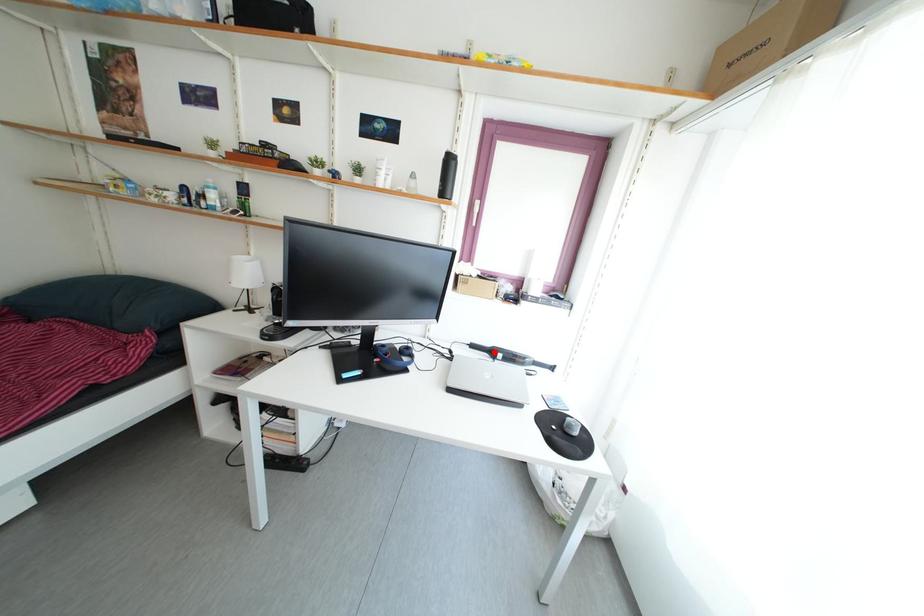
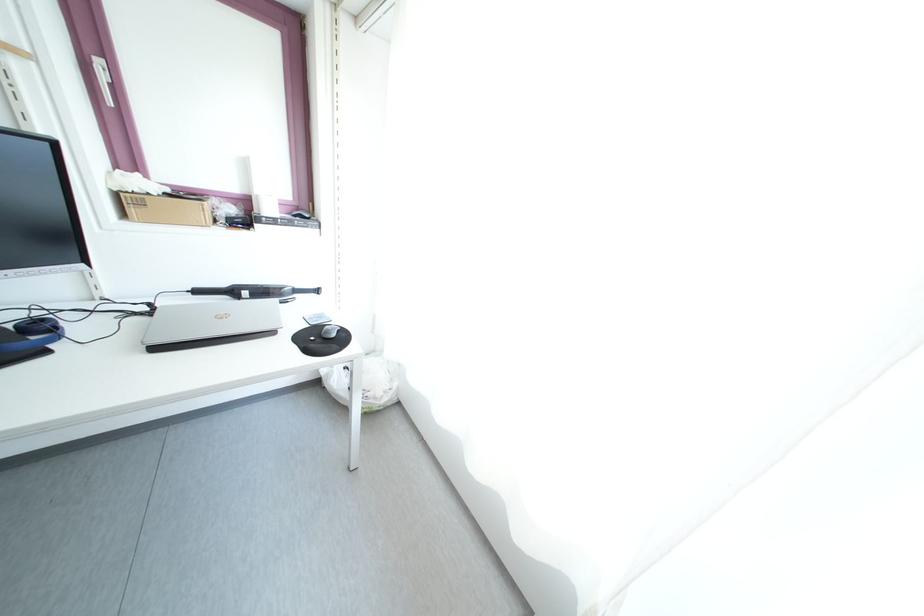
Question: I am providing you with two images of the same scene from different viewpoints. A red point is marked on the first image. At the location where the point appears in image 1, is it still visible in image 2?

Choices:
 (A) Yes
 (B) No

Answer: (A)